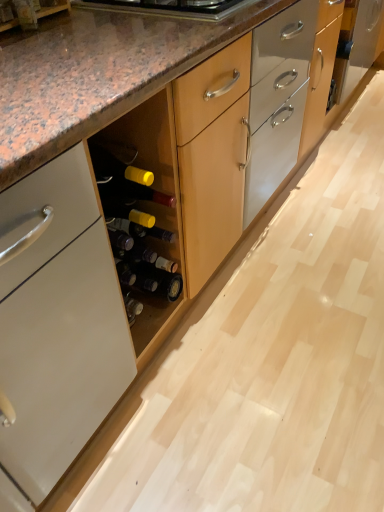
Question: From the image's perspective, does wooden drawer at center appear lower than matte black bottle at center, the 2th beer bottle viewed from the top?

Choices:
 (A) yes
 (B) no

Answer: (B)

Question: Is wooden drawer at center thinner than matte black bottle at center, positioned as the first beer bottle in bottom-to-top order?

Choices:
 (A) no
 (B) yes

Answer: (A)

Question: Is wooden drawer at center oriented towards matte black bottle at center, the 2th beer bottle viewed from the top?

Choices:
 (A) no
 (B) yes

Answer: (A)

Question: Is there a large distance between wooden drawer at center and matte black bottle at center, positioned as the first beer bottle in bottom-to-top order?

Choices:
 (A) yes
 (B) no

Answer: (A)

Question: Is wooden drawer at center in front of matte black bottle at center, the 2th beer bottle viewed from the top?

Choices:
 (A) yes
 (B) no

Answer: (B)

Question: Considering the positions of matte brown wood at lower left and metallic stainless steel cooktop at upper center in the image, is matte brown wood at lower left wider or thinner than metallic stainless steel cooktop at upper center?

Choices:
 (A) thin
 (B) wide

Answer: (A)

Question: Considering their positions, is matte brown wood at lower left located in front of or behind metallic stainless steel cooktop at upper center?

Choices:
 (A) behind
 (B) front

Answer: (B)

Question: Is matte brown wood at lower left inside the boundaries of metallic stainless steel cooktop at upper center, or outside?

Choices:
 (A) inside
 (B) outside

Answer: (B)

Question: From a real-world perspective, is matte brown wood at lower left above or below metallic stainless steel cooktop at upper center?

Choices:
 (A) below
 (B) above

Answer: (B)

Question: From a real-world perspective, relative to matte glass beer bottle at center, the second beer bottle when ordered from bottom to top, is metallic stainless steel cooktop at upper center vertically above or below?

Choices:
 (A) below
 (B) above

Answer: (B)

Question: Is point (187, 7) closer or farther from the camera than point (122, 254)?

Choices:
 (A) closer
 (B) farther

Answer: (A)

Question: Is metallic stainless steel cooktop at upper center in front of or behind matte glass beer bottle at center, the second beer bottle when ordered from bottom to top, in the image?

Choices:
 (A) front
 (B) behind

Answer: (A)

Question: Is metallic stainless steel cooktop at upper center situated inside matte glass beer bottle at center, the first beer bottle positioned from the top, or outside?

Choices:
 (A) inside
 (B) outside

Answer: (B)

Question: From the image's perspective, is matte brown wood at lower left above or below matte glass beer bottle at center, the first beer bottle positioned from the top?

Choices:
 (A) below
 (B) above

Answer: (B)

Question: Is matte brown wood at lower left in front of or behind matte glass beer bottle at center, the second beer bottle when ordered from bottom to top, in the image?

Choices:
 (A) behind
 (B) front

Answer: (B)